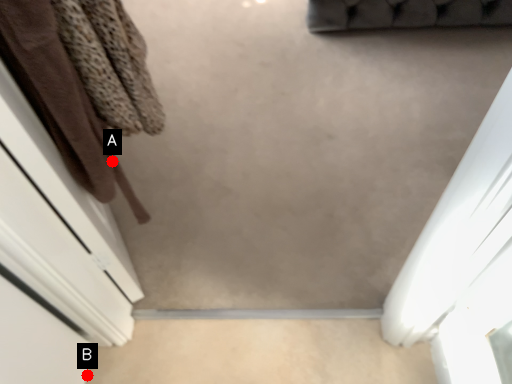
Question: Two points are circled on the image, labeled by A and B beside each circle. Among these points, which one is farthest from the camera?

Choices:
 (A) A is further
 (B) B is further

Answer: (B)